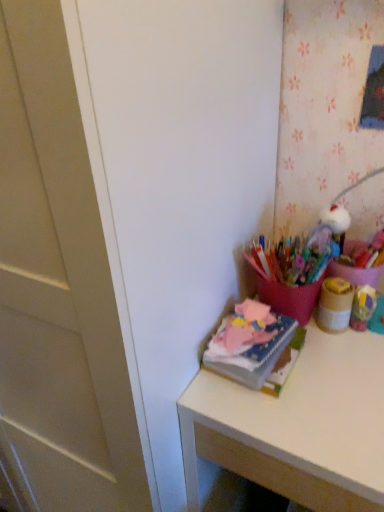
Where is `vacant space to the right of soft pink fabric at upper right`? Image resolution: width=384 pixels, height=512 pixels. vacant space to the right of soft pink fabric at upper right is located at coordinates (340, 361).